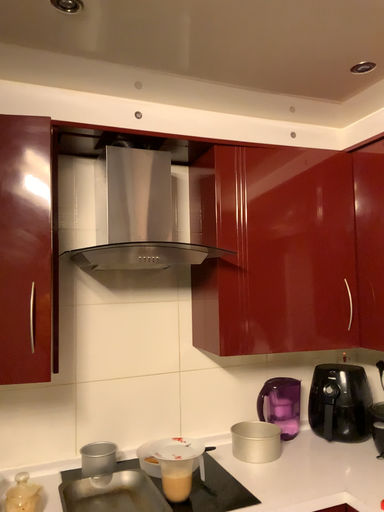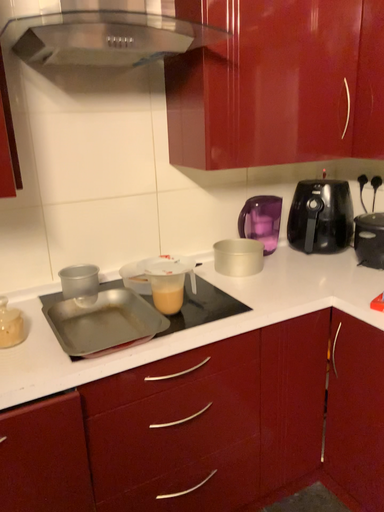
Question: Which way did the camera rotate in the video?

Choices:
 (A) rotated right
 (B) rotated left

Answer: (A)